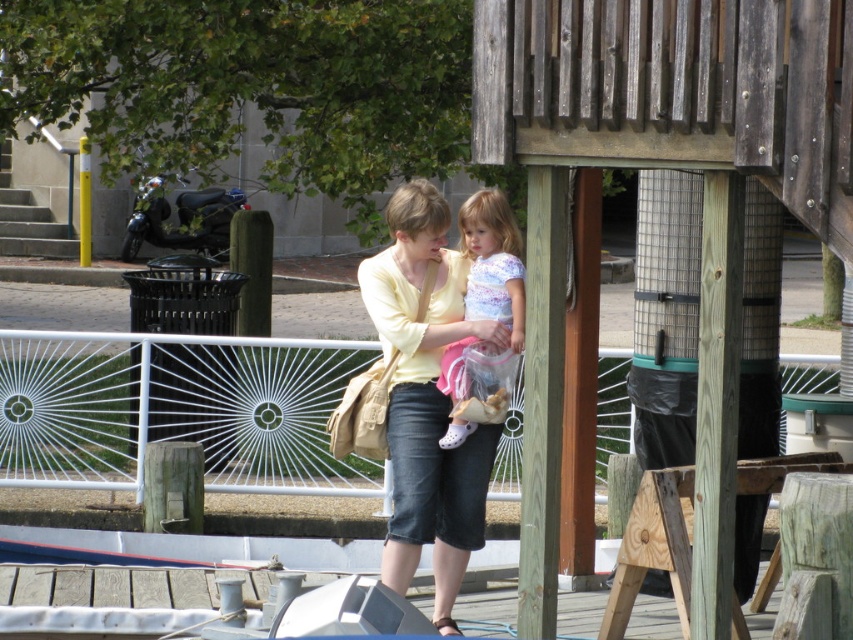
Question: Which point appears farthest from the camera in this image?

Choices:
 (A) (438, 269)
 (B) (498, 189)

Answer: (B)

Question: Does matte yellow sweater at center lie behind pastel floral dress at center?

Choices:
 (A) yes
 (B) no

Answer: (B)

Question: Observing the image, what is the correct spatial positioning of matte yellow sweater at center in reference to pastel floral dress at center?

Choices:
 (A) right
 (B) left

Answer: (B)

Question: Which object appears closest to the camera in this image?

Choices:
 (A) matte yellow sweater at center
 (B) pastel floral dress at center

Answer: (A)

Question: Is matte yellow sweater at center wider than pastel floral dress at center?

Choices:
 (A) no
 (B) yes

Answer: (B)